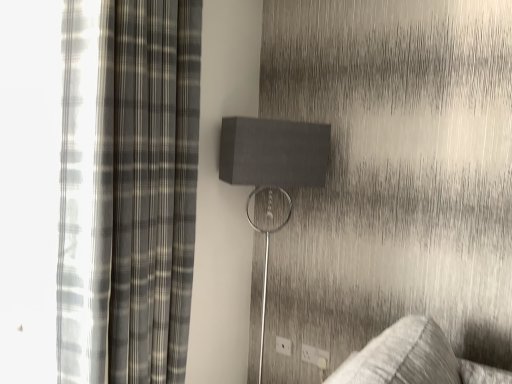
You are a GUI agent. You are given a task and a screenshot of the screen. Output one action in this format:
    pyautogui.click(x=<x>, y=<y>)
    Task: Click on the matte gray speaker at center
    Image resolution: width=512 pixels, height=384 pixels.
    Given the screenshot: What is the action you would take?
    pyautogui.click(x=272, y=168)

Describe the element at coordinates (322, 359) in the screenshot. I see `white plastic electric outlet at lower right, marked as the 1th electric outlet in a front-to-back arrangement` at that location.

In order to face white plastic electric outlet at lower center, positioned as the 2th electric outlet in left-to-right order, should I rotate leftwards or rightwards?

Turn right by 7.804 degrees to look at white plastic electric outlet at lower center, positioned as the 2th electric outlet in left-to-right order.

Where is `matte gray speaker at center`? This screenshot has height=384, width=512. matte gray speaker at center is located at coordinates 272,168.

Is matte gray speaker at center wider or thinner than white plastic electric outlet at lower center, placed as the second electric outlet when sorted from right to left?

Clearly, matte gray speaker at center has more width compared to white plastic electric outlet at lower center, placed as the second electric outlet when sorted from right to left.

Considering the positions of points (247, 138) and (305, 358), is point (247, 138) closer to camera compared to point (305, 358)?

Yes.

Between matte gray speaker at center and white plastic electric outlet at lower center, placed as the second electric outlet when sorted from right to left, which one has more height?

matte gray speaker at center.

Is matte gray speaker at center spatially inside white plastic electric outlet at lower center, the second electric outlet viewed from the front, or outside of it?

The correct answer is: outside.

Which electric outlet is the 3rd one when counting from the right side of the matte gray speaker at center? Please provide its 2D coordinates.

[(322, 359)]

Between matte gray speaker at center and white plastic electric outlet at lower right, the 1th electric outlet when ordered from right to left, which one has smaller width?

Thinner between the two is white plastic electric outlet at lower right, the 1th electric outlet when ordered from right to left.

Can you tell me how much matte gray speaker at center and white plastic electric outlet at lower right, placed as the third electric outlet when sorted from left to right, differ in facing direction?

They differ by 51.4 degrees in their facing directions.

Can you confirm if matte gray speaker at center is smaller than white plastic electric outlet at lower right, placed as the third electric outlet when sorted from left to right?

Incorrect, matte gray speaker at center is not smaller in size than white plastic electric outlet at lower right, placed as the third electric outlet when sorted from left to right.

Is plaid fabric curtain at left bigger or smaller than matte gray speaker at center?

Considering their sizes, plaid fabric curtain at left takes up more space than matte gray speaker at center.

From a real-world perspective, is plaid fabric curtain at left positioned above or below matte gray speaker at center?

Clearly, from a real-world perspective, plaid fabric curtain at left is above matte gray speaker at center.

Is the position of plaid fabric curtain at left more distant than that of matte gray speaker at center?

No, the depth of plaid fabric curtain at left is less than that of matte gray speaker at center.

Does point (176, 76) come in front of point (329, 148)?

Yes, it is in front of point (329, 148).

Choose the correct answer: Is white plastic electric outlet at lower center, marked as the third electric outlet in a front-to-back arrangement, inside white plastic electric outlet at lower center, the second electric outlet viewed from the front, or outside it?

white plastic electric outlet at lower center, marked as the third electric outlet in a front-to-back arrangement, is located beyond the bounds of white plastic electric outlet at lower center, the second electric outlet viewed from the front.

Could you tell me if white plastic electric outlet at lower center, marked as the third electric outlet in a front-to-back arrangement, is facing white plastic electric outlet at lower center, positioned as the 2th electric outlet in left-to-right order?

No, white plastic electric outlet at lower center, marked as the third electric outlet in a front-to-back arrangement, is not aimed at white plastic electric outlet at lower center, positioned as the 2th electric outlet in left-to-right order.

From a real-world perspective, is white plastic electric outlet at lower center, marked as the third electric outlet in a front-to-back arrangement, physically below white plastic electric outlet at lower center, the second electric outlet viewed from the front?

Correct, in the physical world, white plastic electric outlet at lower center, marked as the third electric outlet in a front-to-back arrangement, is lower than white plastic electric outlet at lower center, the second electric outlet viewed from the front.

Is there a large distance between white plastic electric outlet at lower right, placed as the third electric outlet when sorted from left to right, and white plastic electric outlet at lower center, positioned as the 2th electric outlet in left-to-right order?

No.

From a real-world perspective, between white plastic electric outlet at lower right, the 1th electric outlet when ordered from right to left, and white plastic electric outlet at lower center, which appears as the second electric outlet when viewed from the back, who is vertically lower?

In real-world perspective, white plastic electric outlet at lower right, the 1th electric outlet when ordered from right to left, is lower.

Considering the positions of point (328, 365) and point (302, 345), is point (328, 365) closer or farther from the camera than point (302, 345)?

Point (328, 365) is positioned closer to the camera compared to point (302, 345).

Which object is closer to the camera, white plastic electric outlet at lower right, the 1th electric outlet when ordered from right to left, or white plastic electric outlet at lower center, the second electric outlet viewed from the front?

white plastic electric outlet at lower right, the 1th electric outlet when ordered from right to left.

In the scene shown: Considering the sizes of objects white plastic electric outlet at lower center, the 1th electric outlet when ordered from left to right, and plaid fabric curtain at left in the image provided, who is thinner, white plastic electric outlet at lower center, the 1th electric outlet when ordered from left to right, or plaid fabric curtain at left?

white plastic electric outlet at lower center, the 1th electric outlet when ordered from left to right, is thinner.

Who is bigger, white plastic electric outlet at lower center, which is counted as the 1th electric outlet, starting from the back, or plaid fabric curtain at left?

With larger size is plaid fabric curtain at left.

From the picture: Can you see white plastic electric outlet at lower center, which is counted as the 1th electric outlet, starting from the back, touching plaid fabric curtain at left?

They are not placed beside each other.

Is white plastic electric outlet at lower center, the 1th electric outlet when ordered from left to right, taller or shorter than plaid fabric curtain at left?

In the image, white plastic electric outlet at lower center, the 1th electric outlet when ordered from left to right, appears to be shorter than plaid fabric curtain at left.

Is white plastic electric outlet at lower center, the 3th electric outlet from the right, taller than matte gray speaker at center?

No, white plastic electric outlet at lower center, the 3th electric outlet from the right, is not taller than matte gray speaker at center.

Which is less distant, (284, 353) or (302, 125)?

Point (284, 353) appears to be farther away from the viewer than point (302, 125).

In terms of width, does white plastic electric outlet at lower center, which is counted as the 1th electric outlet, starting from the back, look wider or thinner when compared to matte gray speaker at center?

In the image, white plastic electric outlet at lower center, which is counted as the 1th electric outlet, starting from the back, appears to be more narrow than matte gray speaker at center.

Measure the distance between white plastic electric outlet at lower center, the 1th electric outlet when ordered from left to right, and matte gray speaker at center.

white plastic electric outlet at lower center, the 1th electric outlet when ordered from left to right, is 96.39 centimeters away from matte gray speaker at center.

Which electric outlet is the 2nd one when counting from the back of the matte gray speaker at center? Please provide its 2D coordinates.

[(314, 355)]

Which electric outlet is the 3rd one when counting from the right side of the matte gray speaker at center? Please provide its 2D coordinates.

[(322, 359)]

Based on the photo, looking at the image, which one is located further to white plastic electric outlet at lower center, positioned as the 2th electric outlet in left-to-right order, plaid fabric curtain at left or white plastic electric outlet at lower right, placed as the third electric outlet when sorted from left to right?

plaid fabric curtain at left.

Estimate the real-world distances between objects in this image. Which object is closer to matte gray speaker at center, white plastic electric outlet at lower right, the 1th electric outlet when ordered from right to left, or white plastic electric outlet at lower center, the second electric outlet viewed from the front?

The object closer to matte gray speaker at center is white plastic electric outlet at lower center, the second electric outlet viewed from the front.

Estimate the real-world distances between objects in this image. Which object is closer to white plastic electric outlet at lower center, positioned as the 2th electric outlet in left-to-right order, white plastic electric outlet at lower center, the 3th electric outlet from the right, or matte gray speaker at center?

white plastic electric outlet at lower center, the 3th electric outlet from the right, is positioned closer to the anchor white plastic electric outlet at lower center, positioned as the 2th electric outlet in left-to-right order.

Which object lies further to the anchor point matte gray speaker at center, white plastic electric outlet at lower center, the 3th electric outlet from the right, or plaid fabric curtain at left?

Based on the image, white plastic electric outlet at lower center, the 3th electric outlet from the right, appears to be further to matte gray speaker at center.

From the image, which object appears to be nearer to white plastic electric outlet at lower right, acting as the 3th electric outlet starting from the back, white plastic electric outlet at lower center, the 1th electric outlet when ordered from left to right, or white plastic electric outlet at lower center, the second electric outlet viewed from the front?

The object closer to white plastic electric outlet at lower right, acting as the 3th electric outlet starting from the back, is white plastic electric outlet at lower center, the second electric outlet viewed from the front.

Estimate the real-world distances between objects in this image. Which object is closer to plaid fabric curtain at left, white plastic electric outlet at lower right, marked as the 1th electric outlet in a front-to-back arrangement, or white plastic electric outlet at lower center, marked as the third electric outlet in a front-to-back arrangement?

Among the two, white plastic electric outlet at lower center, marked as the third electric outlet in a front-to-back arrangement, is located nearer to plaid fabric curtain at left.

Which object lies further to the anchor point white plastic electric outlet at lower center, the second electric outlet viewed from the front, white plastic electric outlet at lower center, the 1th electric outlet when ordered from left to right, or white plastic electric outlet at lower right, acting as the 3th electric outlet starting from the back?

white plastic electric outlet at lower center, the 1th electric outlet when ordered from left to right, lies further to white plastic electric outlet at lower center, the second electric outlet viewed from the front, than the other object.

Which object lies nearer to the anchor point white plastic electric outlet at lower center, the second electric outlet viewed from the front, matte gray speaker at center or white plastic electric outlet at lower right, placed as the third electric outlet when sorted from left to right?

white plastic electric outlet at lower right, placed as the third electric outlet when sorted from left to right.

Locate an element on the screen. table lamp positioned between plaid fabric curtain at left and white plastic electric outlet at lower right, the 1th electric outlet when ordered from right to left, from near to far is located at coordinates (272, 168).

The height and width of the screenshot is (384, 512). I want to click on electric outlet between plaid fabric curtain at left and white plastic electric outlet at lower center, placed as the second electric outlet when sorted from right to left, in the front-back direction, so click(322, 359).

At what (x,y) coordinates should I click in order to perform the action: click on table lamp positioned between plaid fabric curtain at left and white plastic electric outlet at lower center, the 1th electric outlet when ordered from left to right, from near to far. Please return your answer as a coordinate pair (x, y). Looking at the image, I should click on (272, 168).

Identify the location of table lamp between plaid fabric curtain at left and white plastic electric outlet at lower center, placed as the second electric outlet when sorted from right to left, in the front-back direction. (272, 168).